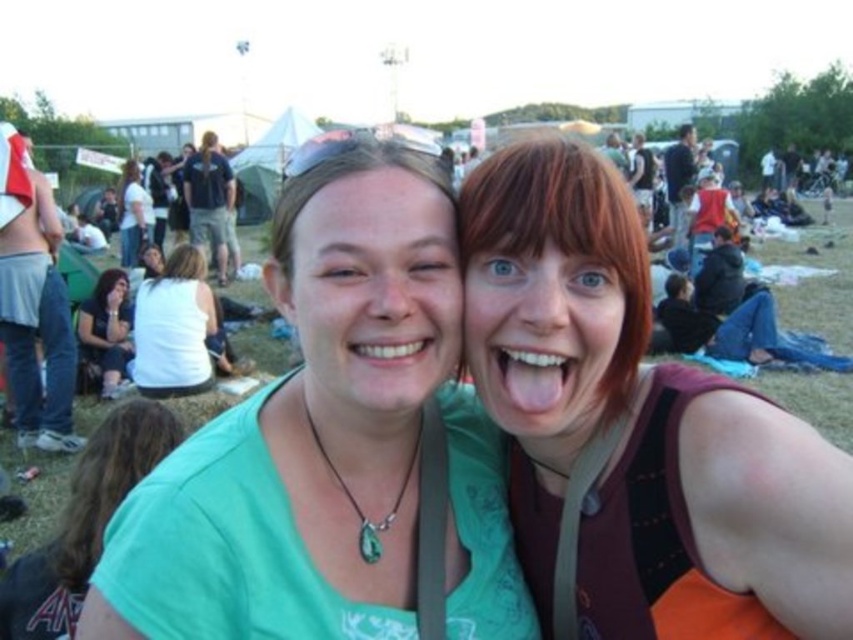
You are at a festival and want to take a photo with both the green matte shirt at center and the matte white shirt at center. Which one should you stand to the left of to include both in the frame?

You should stand to the left of the matte white shirt at center because the green matte shirt at center is positioned on the right side of it, so both will be in frame when you position yourself that way.

You are a photographer trying to capture a group photo. You need to ensure that the matte orange tank top at right and the white cotton shirt at center are both visible in the frame. Based on their heights, which one might you position closer to the front of the group to ensure both are visible?

The matte orange tank top at right is much taller than the white cotton shirt at center. To ensure both are visible, position the white cotton shirt at center closer to the front of the group so that the taller matte orange tank top at right can be placed slightly behind but still visible over the shorter individual.

You are at a festival and want to find the taller person between the green matte shirt at center and the green fabric shirt at lower left. Which one should you look for?

The green matte shirt at center is taller than the green fabric shirt at lower left, so you should look for the green matte shirt at center.